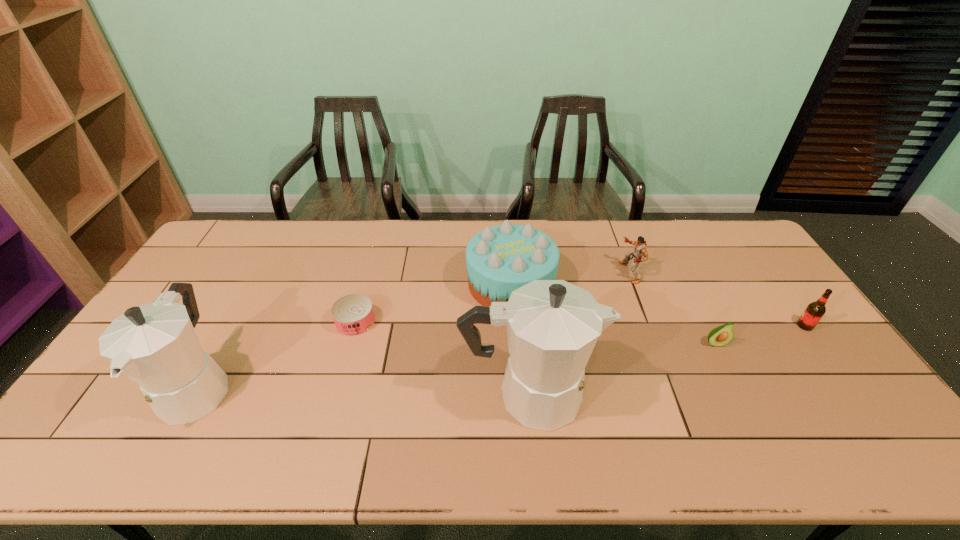
Where is `object present at the left edge`? Image resolution: width=960 pixels, height=540 pixels. object present at the left edge is located at coordinates (x=155, y=345).

This screenshot has height=540, width=960. In order to click on object that is at the right edge in this screenshot , I will do pos(813,313).

Find the location of a particular element. This screenshot has width=960, height=540. object present at the near left corner is located at coordinates (155, 345).

Identify the location of free space at the far edge of the desktop. The width and height of the screenshot is (960, 540). (691, 253).

Identify the location of vacant space at the near edge of the desktop. The width and height of the screenshot is (960, 540). (456, 399).

The height and width of the screenshot is (540, 960). Find the location of `vacant space at the left edge of the desktop`. vacant space at the left edge of the desktop is located at coordinates (219, 300).

In the image, there is a desktop. What are the coordinates of `blank space at the far left corner` in the screenshot? It's located at (230, 246).

Locate an element on the screen. The height and width of the screenshot is (540, 960). empty space that is in between the shorter coffeepot and the second object from left to right is located at coordinates (277, 354).

Where is `free point between the rightmost object and the third tallest object`? Image resolution: width=960 pixels, height=540 pixels. free point between the rightmost object and the third tallest object is located at coordinates (658, 305).

At what (x,y) coordinates should I click in order to perform the action: click on unoccupied position between the cake and the puncher. Please return your answer as a coordinate pair (x, y). This screenshot has width=960, height=540. Looking at the image, I should click on (570, 278).